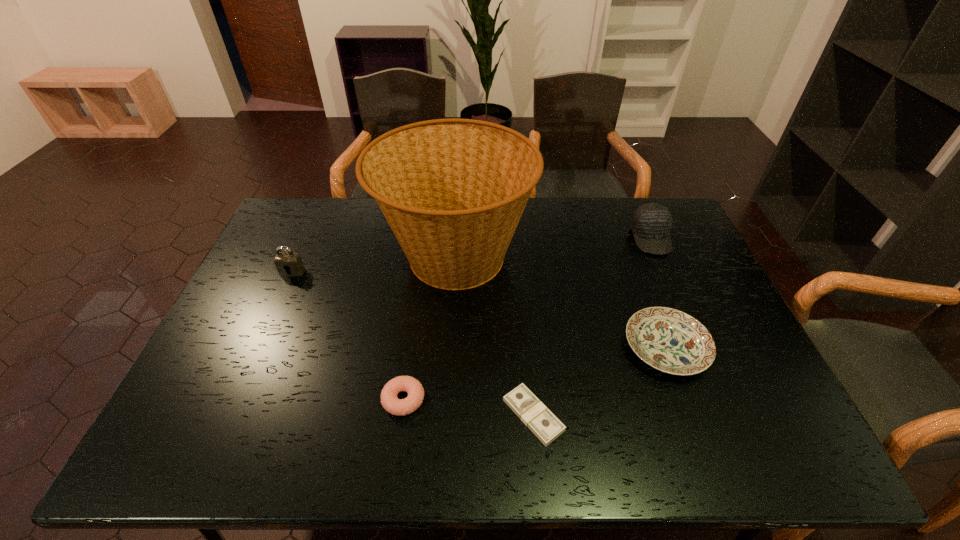
You are a GUI agent. You are given a task and a screenshot of the screen. Output one action in this format:
    pyautogui.click(x=<x>, y=<y>)
    Task: Click on the vacant space located 0.220m on the right of the doughnut
    
    Given the screenshot: What is the action you would take?
    pyautogui.click(x=516, y=400)

Find the location of a particular element. The width and height of the screenshot is (960, 540). vacant region located on the back of the shortest object is located at coordinates (523, 314).

Identify the location of basket that is positioned at the far edge. This screenshot has height=540, width=960. (453, 191).

Identify the location of baseball cap that is at the far edge. Image resolution: width=960 pixels, height=540 pixels. (651, 223).

Locate an element on the screen. The width and height of the screenshot is (960, 540). object that is at the near edge is located at coordinates (532, 412).

I want to click on object situated at the left edge, so click(289, 262).

This screenshot has height=540, width=960. Find the location of `baseball cap present at the right edge`. baseball cap present at the right edge is located at coordinates (651, 223).

Locate an element on the screen. This screenshot has height=540, width=960. plate at the right edge is located at coordinates (669, 340).

Locate an element on the screen. The width and height of the screenshot is (960, 540). object that is positioned at the far right corner is located at coordinates (651, 223).

Identify the location of free space at the far edge. (373, 208).